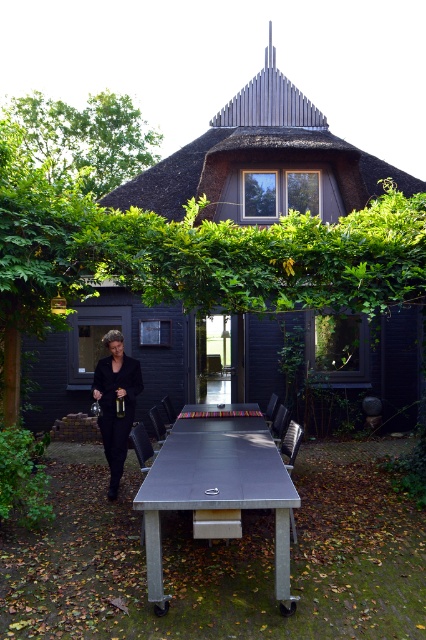
You are planning to host a small gathering at the dark gray wooden hut at center and need to move the metallic silver picnic table at center to make space. Based on their sizes, which object should be moved first to accommodate the other?

The metallic silver picnic table at center should be moved first because it is smaller than the dark gray wooden hut at center, making it easier to relocate to create space.

You are standing in the outdoor area and want to place a small potted plant on the dark gray wooden hut at center. Considering the height of the black fabric coat at left, can you estimate if the hut is tall enough to safely place the plant without it being knocked over by someone wearing the coat?

The dark gray wooden hut at center has a greater height compared to the black fabric coat at left, so placing the potted plant on the hut should be safe as it is taller than the coat, reducing the risk of accidental knocks.

You are standing in front of the traditional house and notice two points marked on the ground. Which point is closer to you, point [216,428] or point [120,438]?

Point [216,428] is further to the viewer than point [120,438], so the closer point is point [120,438].